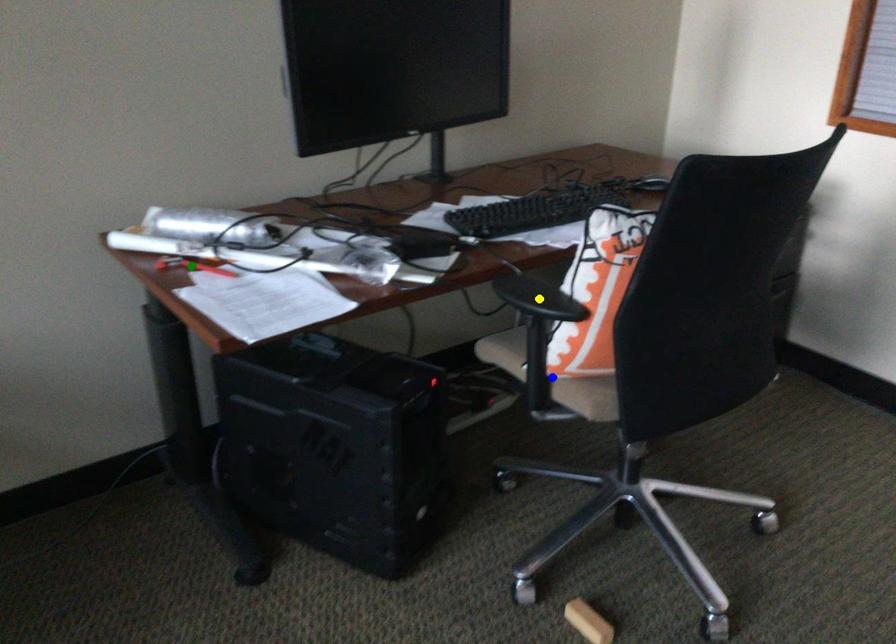
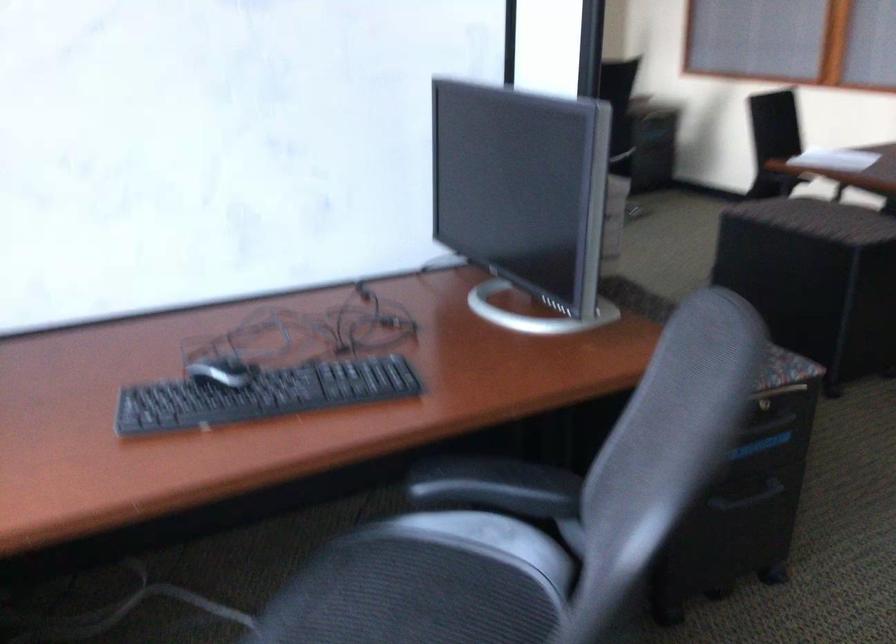
I am providing you with two images of the same scene from different viewpoints. Three points are marked in image1. Which point corresponds to a part or object that is occluded in image2?In image1, three points are marked. Which of them correspond to a part or object that is occluded in image2?Among the three points shown in image1, which one corresponds to a part or object that is no longer visible due to occlusion in image2?

green point, yellow point, blue point cannot be seen in image2.